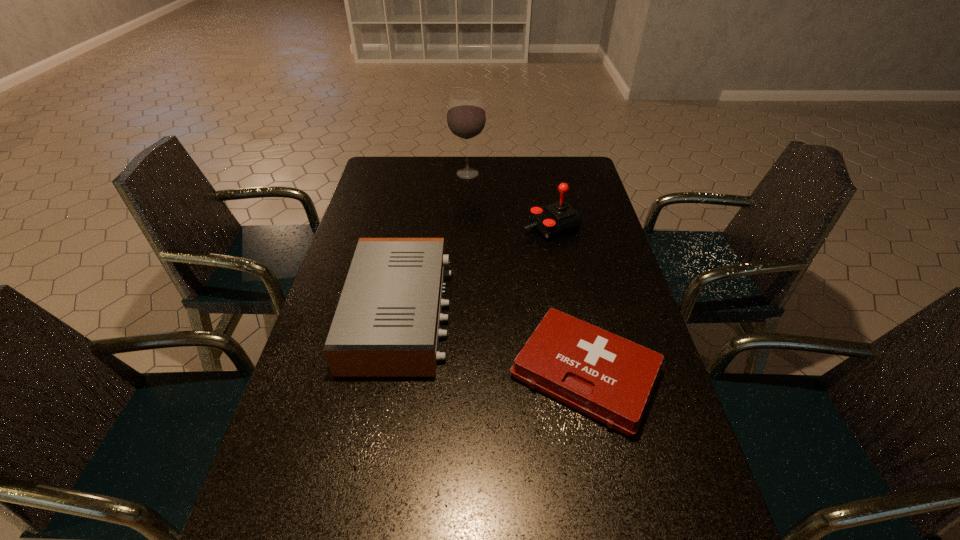
Find the location of a particular element. This screenshot has width=960, height=540. the farthest object is located at coordinates (466, 119).

The height and width of the screenshot is (540, 960). I want to click on the tallest object, so click(466, 119).

Locate an element on the screen. The width and height of the screenshot is (960, 540). joystick is located at coordinates (555, 219).

Find the location of a particular element. the third nearest object is located at coordinates (555, 219).

The height and width of the screenshot is (540, 960). Find the location of `the second shortest object`. the second shortest object is located at coordinates (387, 323).

The height and width of the screenshot is (540, 960). I want to click on the shortest object, so click(609, 378).

Where is `free region located 0.400m on the front of the tallest object`? This screenshot has width=960, height=540. free region located 0.400m on the front of the tallest object is located at coordinates (465, 249).

This screenshot has height=540, width=960. What are the coordinates of `vacant space located on the front of the joystick` in the screenshot? It's located at (556, 251).

Locate an element on the screen. Image resolution: width=960 pixels, height=540 pixels. free region located 0.070m on the control panel of the second shortest object is located at coordinates coord(475,313).

Where is `vacant space located on the left of the shortest object`? vacant space located on the left of the shortest object is located at coordinates (422, 373).